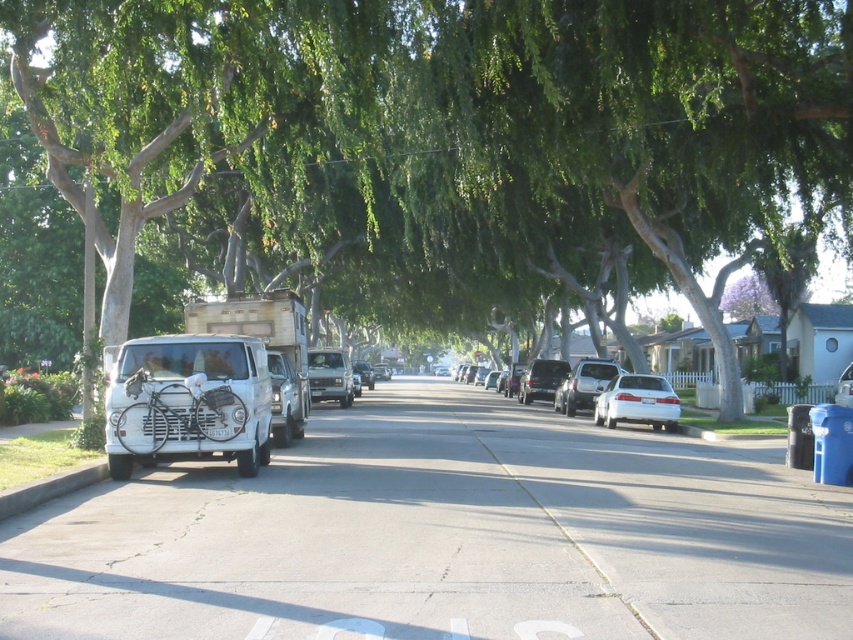
You are standing at the point with coordinates 0.5, 0.5 in the image. You want to walk to the white matte car at center. Which direction should you move in terms of the image coordinate system?

The white matte car at center is located at coordinates (844, 387). Since your current position is at (426, 320), you should move towards the right and downward in the image coordinate system to reach the white matte car at center.

You are standing at the intersection and need to cross the street to reach the white matte sedan at center. Based on the scene description, where should you look for the sedan?

The white matte sedan at center is located at the center of the image, so you should look towards the middle of the street to find it.